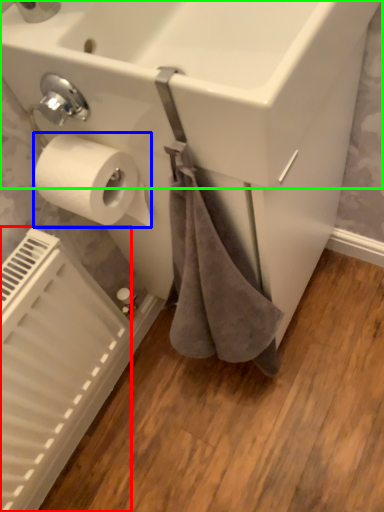
Question: Which object is the farthest from radiator (highlighted by a red box)? Choose among these: toilet paper (highlighted by a blue box) or sink (highlighted by a green box).

Choices:
 (A) toilet paper
 (B) sink

Answer: (B)